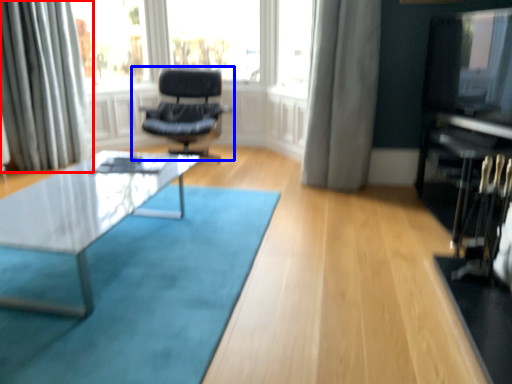
Question: Which point is further to the camera, curtain (highlighted by a red box) or chair (highlighted by a blue box)?

Choices:
 (A) curtain
 (B) chair

Answer: (B)